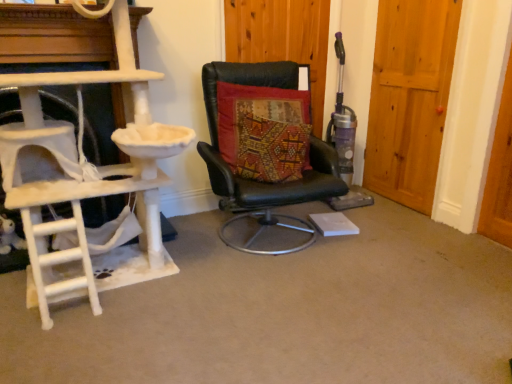
I want to click on free area in between black leather chair at center and white carpeted ladder at left, so click(211, 257).